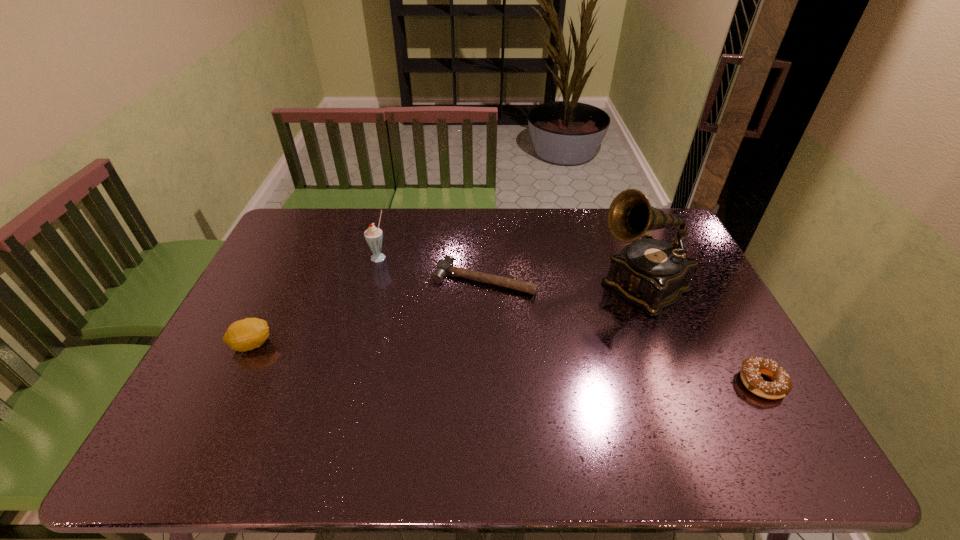
Identify the location of the third tallest object. Image resolution: width=960 pixels, height=540 pixels. (247, 334).

Locate an element on the screen. Image resolution: width=960 pixels, height=540 pixels. the leftmost object is located at coordinates (247, 334).

You are a GUI agent. You are given a task and a screenshot of the screen. Output one action in this format:
    pyautogui.click(x=<x>, y=<y>)
    Task: Click on the fourth tallest object
    
    Given the screenshot: What is the action you would take?
    pyautogui.click(x=752, y=368)

This screenshot has width=960, height=540. In order to click on doughnut in this screenshot , I will do `click(752, 368)`.

Find the location of a particular element. the fourth shortest object is located at coordinates (373, 235).

Identify the location of milkshake. (373, 235).

At what (x,y) coordinates should I click in order to perform the action: click on the tallest object. Please return your answer as a coordinate pair (x, y). The width and height of the screenshot is (960, 540). Looking at the image, I should click on click(653, 274).

Locate an element on the screen. The width and height of the screenshot is (960, 540). the shortest object is located at coordinates (444, 266).

Image resolution: width=960 pixels, height=540 pixels. I want to click on the third object from left to right, so click(x=444, y=266).

Find the location of a particular element. The height and width of the screenshot is (540, 960). vacant region located 0.080m at the stem end of the fourth farthest object is located at coordinates (302, 345).